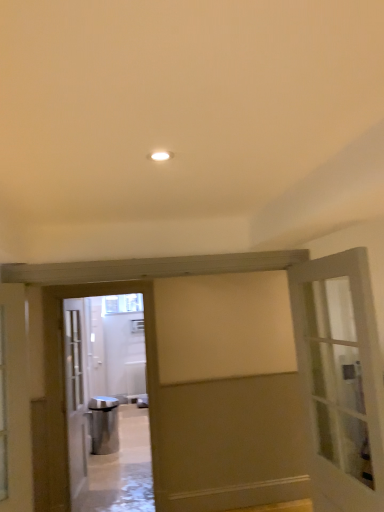
Question: Considering the relative sizes of white glass door at left, the 2th door when ordered from front to back, and silver metallic elevator at center in the image provided, is white glass door at left, the 2th door when ordered from front to back, shorter than silver metallic elevator at center?

Choices:
 (A) no
 (B) yes

Answer: (B)

Question: Does white glass door at left, the 2th door when ordered from front to back, come behind silver metallic elevator at center?

Choices:
 (A) no
 (B) yes

Answer: (B)

Question: Is there a large distance between white glass door at left, the 1th door when ordered from back to front, and silver metallic elevator at center?

Choices:
 (A) yes
 (B) no

Answer: (A)

Question: Can you confirm if white glass door at left, the 2th door when ordered from front to back, is positioned to the left of silver metallic elevator at center?

Choices:
 (A) yes
 (B) no

Answer: (A)

Question: Is silver metallic elevator at center completely or partially inside white glass door at left, which is the 2th door in right-to-left order?

Choices:
 (A) no
 (B) yes

Answer: (A)

Question: From a real-world perspective, is matte gray door at right, the second door viewed from the left, physically located above or below white glass door at left, the 1th door when ordered from back to front?

Choices:
 (A) above
 (B) below

Answer: (A)

Question: Considering the positions of matte gray door at right, the 1th door when ordered from front to back, and white glass door at left, marked as the first door in a left-to-right arrangement, in the image, is matte gray door at right, the 1th door when ordered from front to back, bigger or smaller than white glass door at left, marked as the first door in a left-to-right arrangement,?

Choices:
 (A) small
 (B) big

Answer: (A)

Question: From the image's perspective, is matte gray door at right, acting as the first door starting from the right, located above or below white glass door at left, marked as the first door in a left-to-right arrangement?

Choices:
 (A) below
 (B) above

Answer: (B)

Question: Is matte gray door at right, the 1th door when ordered from front to back, wider or thinner than white glass door at left, which is the 2th door in right-to-left order?

Choices:
 (A) wide
 (B) thin

Answer: (B)

Question: Does point (94, 312) appear closer or farther from the camera than point (81, 347)?

Choices:
 (A) farther
 (B) closer

Answer: (A)

Question: From their relative heights in the image, would you say silver metallic elevator at center is taller or shorter than white glass door at left, the 2th door when ordered from front to back?

Choices:
 (A) short
 (B) tall

Answer: (B)

Question: From a real-world perspective, is silver metallic elevator at center physically located above or below white glass door at left, the 1th door when ordered from back to front?

Choices:
 (A) below
 (B) above

Answer: (B)

Question: Based on their sizes in the image, would you say silver metallic elevator at center is bigger or smaller than white glass door at left, the 1th door when ordered from back to front?

Choices:
 (A) big
 (B) small

Answer: (B)

Question: Looking at the image, does clear glass window at center seem bigger or smaller compared to matte gray door at right, the second door viewed from the left?

Choices:
 (A) big
 (B) small

Answer: (B)

Question: In terms of height, does clear glass window at center look taller or shorter compared to matte gray door at right, the 1th door when ordered from front to back?

Choices:
 (A) short
 (B) tall

Answer: (A)